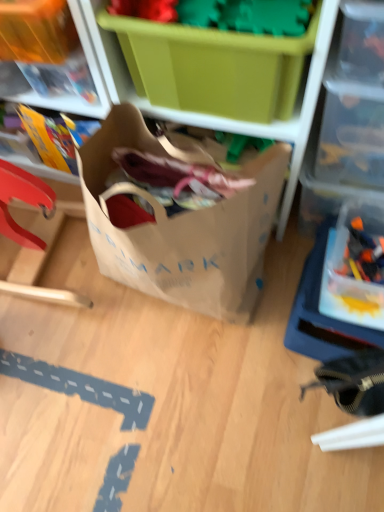
Question: Is point (51, 13) positioned closer to the camera than point (377, 245)?

Choices:
 (A) farther
 (B) closer

Answer: (B)

Question: From a real-world perspective, is matte plastic storage box at upper left, which appears as the third storage box when viewed from the right, above or below transparent plastic storage box at right, which appears as the 1th storage box when viewed from the right?

Choices:
 (A) above
 (B) below

Answer: (A)

Question: Considering the real-world distances, which object is farthest from the translucent plastic toy at right?

Choices:
 (A) brown paper bag at center
 (B) green plastic storage box at upper center, acting as the second storage box starting from the left
 (C) matte plastic storage box at upper left, the 1th storage box when ordered from left to right
 (D) transparent plastic container at upper right
 (E) transparent plastic storage box at right, which appears as the 1th storage box when viewed from the right

Answer: (C)

Question: Considering the real-world distances, which object is farthest from the transparent plastic storage box at right, which appears as the 3th storage box when viewed from the left?

Choices:
 (A) translucent plastic toy at right
 (B) matte plastic storage box at upper left, which appears as the third storage box when viewed from the right
 (C) brown paper bag at center
 (D) transparent plastic container at upper right
 (E) green plastic storage box at upper center, the 2th storage box when ordered from right to left

Answer: (B)